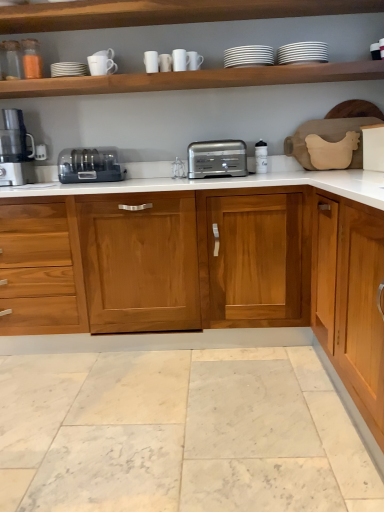
Question: Is white glossy mug at upper center, the fourth tableware positioned from the right, thinner than wooden cabinet at center?

Choices:
 (A) no
 (B) yes

Answer: (B)

Question: Can you confirm if white glossy mug at upper center, acting as the 3th tableware starting from the left, is taller than wooden cabinet at center?

Choices:
 (A) yes
 (B) no

Answer: (B)

Question: Is white glossy mug at upper center, the fourth tableware positioned from the right, touching wooden cabinet at center?

Choices:
 (A) yes
 (B) no

Answer: (B)

Question: From the image's perspective, is white glossy mug at upper center, the fourth tableware positioned from the right, located beneath wooden cabinet at center?

Choices:
 (A) no
 (B) yes

Answer: (A)

Question: Is white glossy mug at upper center, acting as the 3th tableware starting from the left, not inside wooden cabinet at center?

Choices:
 (A) yes
 (B) no

Answer: (A)

Question: Does white glossy mug at upper center, acting as the 3th tableware starting from the left, contain wooden cabinet at center?

Choices:
 (A) no
 (B) yes

Answer: (A)

Question: Would you say white matte cup at upper center, acting as the 2th tableware starting from the left, contains wooden shelf at upper center, which appears as the 2th shelf when ordered from the bottom?

Choices:
 (A) no
 (B) yes

Answer: (A)

Question: Is wooden shelf at upper center, which is the first shelf from top to bottom, at the back of white matte cup at upper center, acting as the 2th tableware starting from the left?

Choices:
 (A) yes
 (B) no

Answer: (B)

Question: Can you confirm if white matte cup at upper center, positioned as the 5th tableware in right-to-left order, is wider than wooden shelf at upper center, which is the first shelf from top to bottom?

Choices:
 (A) yes
 (B) no

Answer: (B)

Question: Does white matte cup at upper center, positioned as the 5th tableware in right-to-left order, touch wooden shelf at upper center, which appears as the 2th shelf when ordered from the bottom?

Choices:
 (A) yes
 (B) no

Answer: (B)

Question: Is white matte cup at upper center, positioned as the 5th tableware in right-to-left order, positioned behind wooden shelf at upper center, which is the first shelf from top to bottom?

Choices:
 (A) yes
 (B) no

Answer: (A)

Question: Considering the relative sizes of white matte cup at upper center, positioned as the 5th tableware in right-to-left order, and wooden shelf at upper center, which is the first shelf from top to bottom, in the image provided, is white matte cup at upper center, positioned as the 5th tableware in right-to-left order, thinner than wooden shelf at upper center, which is the first shelf from top to bottom,?

Choices:
 (A) no
 (B) yes

Answer: (B)

Question: Is white glossy plates at upper center, which ranks as the 2th tableware in right-to-left order, directly adjacent to white matte cup at upper center, positioned as the 5th tableware in right-to-left order?

Choices:
 (A) no
 (B) yes

Answer: (A)